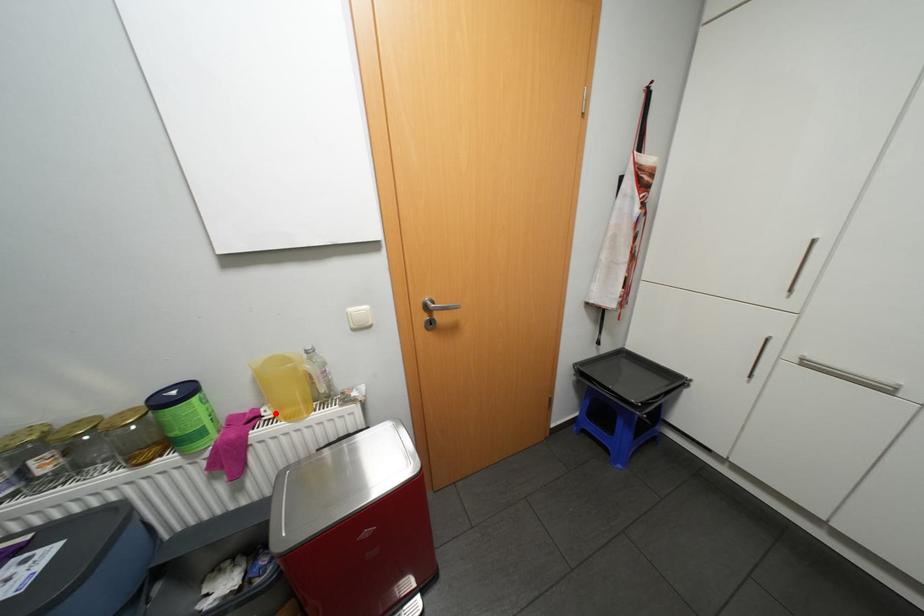
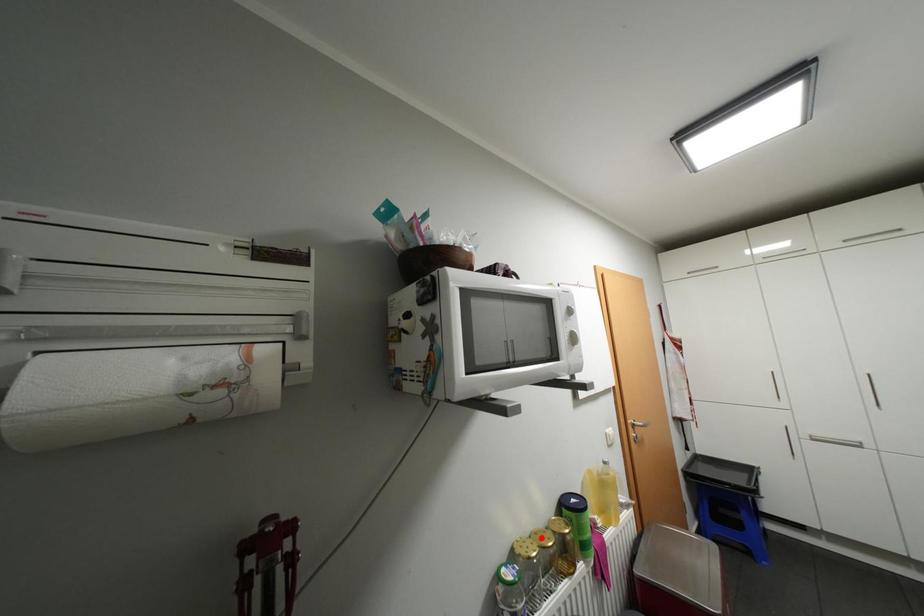
I am providing you with two images of the same scene from different viewpoints. A red point is marked on the first image and another point is marked on the second image. Is the marked point in image1 the same physical position as the marked point in image2?

No